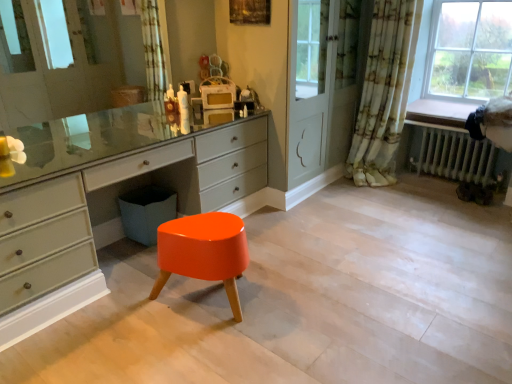
This screenshot has width=512, height=384. I want to click on free space underneath glossy orange stool at center (from a real-world perspective), so click(214, 307).